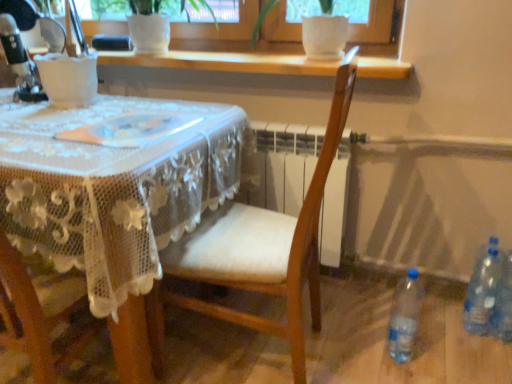
Locate an element on the screen. Image resolution: width=512 pixels, height=384 pixels. free space in front of transparent plastic bottle at lower right, the 1th bottle in the left-to-right sequence is located at coordinates (401, 374).